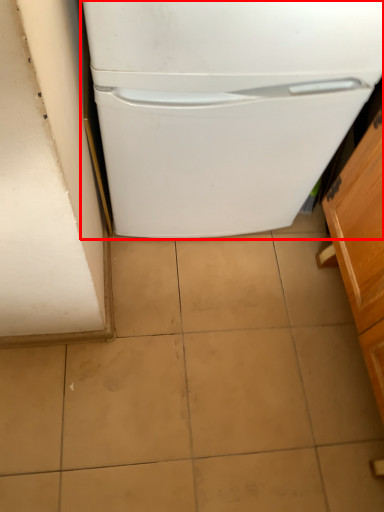
Question: From the image's perspective, where is refrigerator (annotated by the red box) located in relation to cabinetry in the image?

Choices:
 (A) above
 (B) below

Answer: (A)